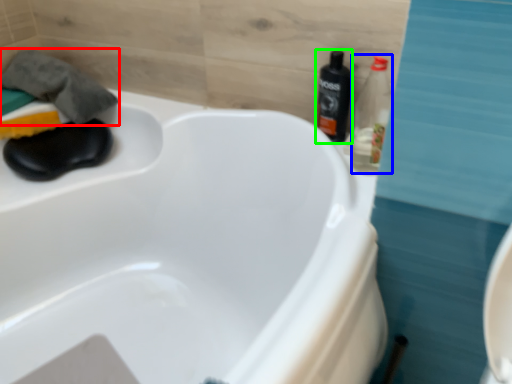
Question: Estimate the real-world distances between objects in this image. Which object is farther from bath towel (highlighted by a red box), bottle (highlighted by a blue box) or bottle (highlighted by a green box)?

Choices:
 (A) bottle
 (B) bottle

Answer: (A)